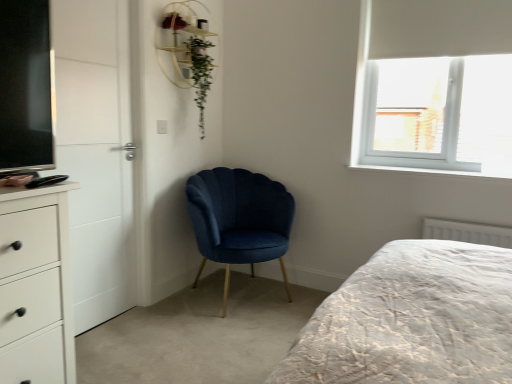
Question: Is white textured radiator at lower right oriented away from white matte chest of drawers at left?

Choices:
 (A) yes
 (B) no

Answer: (B)

Question: Would you say white textured radiator at lower right is outside white matte chest of drawers at left?

Choices:
 (A) yes
 (B) no

Answer: (A)

Question: From the image's perspective, does white textured radiator at lower right appear lower than white matte chest of drawers at left?

Choices:
 (A) yes
 (B) no

Answer: (B)

Question: Is white textured radiator at lower right smaller than white matte chest of drawers at left?

Choices:
 (A) no
 (B) yes

Answer: (B)

Question: From the image's perspective, is white textured radiator at lower right above white matte chest of drawers at left?

Choices:
 (A) no
 (B) yes

Answer: (B)

Question: Does white textured radiator at lower right have a larger size compared to white matte chest of drawers at left?

Choices:
 (A) no
 (B) yes

Answer: (A)

Question: Is white plastic window at upper right outside white textured radiator at lower right?

Choices:
 (A) yes
 (B) no

Answer: (A)

Question: From the image's perspective, is white plastic window at upper right above white textured radiator at lower right?

Choices:
 (A) no
 (B) yes

Answer: (B)

Question: Can you confirm if white plastic window at upper right is thinner than white textured radiator at lower right?

Choices:
 (A) no
 (B) yes

Answer: (A)

Question: From a real-world perspective, is white plastic window at upper right positioned over white textured radiator at lower right based on gravity?

Choices:
 (A) yes
 (B) no

Answer: (A)

Question: Considering the relative sizes of white plastic window at upper right and white textured radiator at lower right in the image provided, is white plastic window at upper right taller than white textured radiator at lower right?

Choices:
 (A) yes
 (B) no

Answer: (A)

Question: Is the position of white plastic window at upper right more distant than that of white textured radiator at lower right?

Choices:
 (A) no
 (B) yes

Answer: (B)

Question: Is white matte chest of drawers at left inside velvet blue chair at center?

Choices:
 (A) no
 (B) yes

Answer: (A)